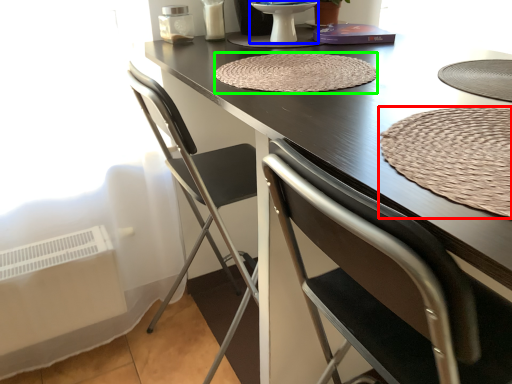
Question: Estimate the real-world distances between objects in this image. Which object is closer to mat (highlighted by a red box), round table (highlighted by a blue box) or mat (highlighted by a green box)?

Choices:
 (A) round table
 (B) mat

Answer: (B)